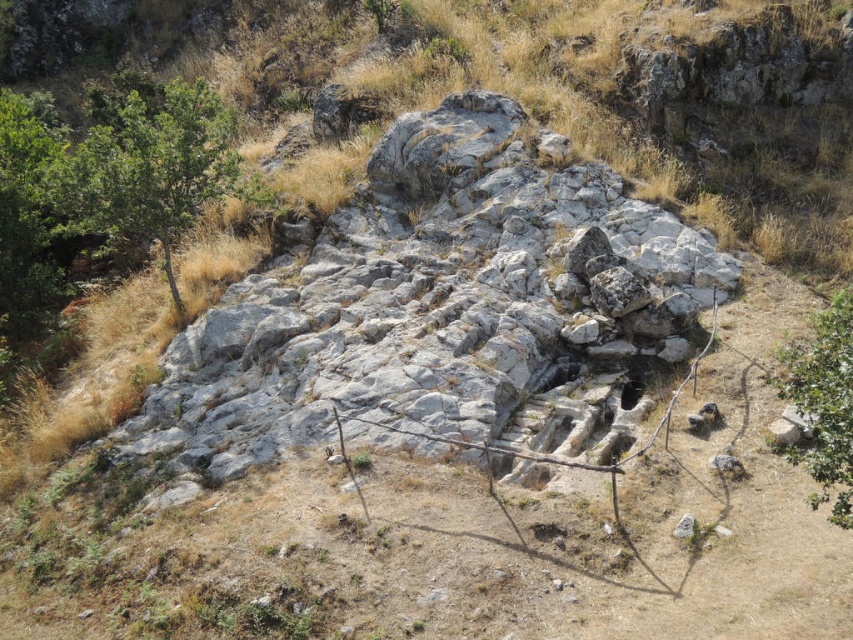
You are a hiker planning to set up a tent between the green leafy tree at left and the green leafy tree at lower right. Which tree has a wider canopy to provide more shade?

The green leafy tree at left has a larger width than the green leafy tree at lower right, so it provides a wider canopy for shade.

You are standing at the center of the image and want to walk towards the green leafy tree at left. In which direction should you head?

The green leafy tree at left is located at point 0.264 on the x axis and 0.179 on the y axis. Since you are at the center, you should head towards the left and slightly upwards to reach the green leafy tree at left.

You are a hiker trying to determine which tree to climb for a better view. The scene has a green leafy tree at left and a green leafy tree at lower right. Which tree would provide a higher vantage point?

The green leafy tree at left is taller than the green leafy tree at lower right, so it would provide a higher vantage point.